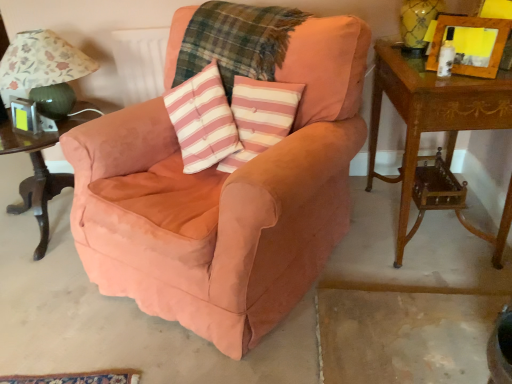
Locate an element on the screen. This screenshot has width=512, height=384. vacant space underneath dark wood table at left, arranged as the second table when viewed from the right (from a real-world perspective) is located at coordinates (37, 230).